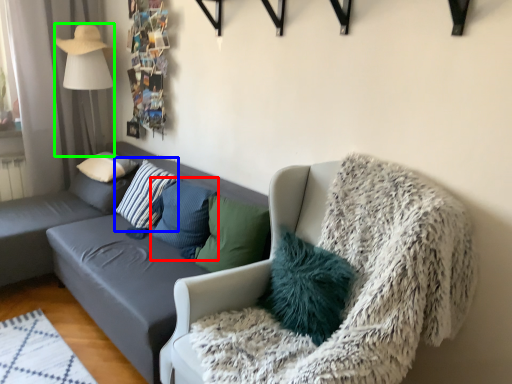
Question: Which object is positioned farthest from pillow (highlighted by a red box)? Select from pillow (highlighted by a blue box) and lamp (highlighted by a green box).

Choices:
 (A) pillow
 (B) lamp

Answer: (B)